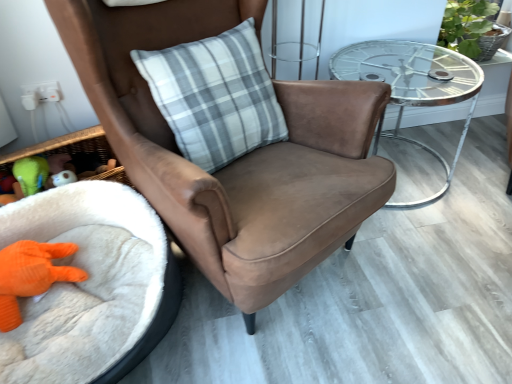
Question: Based on their sizes in the image, would you say orange knitted toy at lower left, the 2th toy positioned from the top, is bigger or smaller than gray plaid pillow at center?

Choices:
 (A) small
 (B) big

Answer: (A)

Question: Is orange knitted toy at lower left, the 2th toy positioned from the top, in front of or behind gray plaid pillow at center in the image?

Choices:
 (A) behind
 (B) front

Answer: (A)

Question: Which is farther from the suede brown armchair at center?

Choices:
 (A) white fluffy infant bed at lower left
 (B) green rubber duck at lower left, placed as the second toy when sorted from bottom to top
 (C) metallic glass table at right
 (D) orange knitted toy at lower left, the first toy in the bottom-to-top sequence
 (E) gray plaid pillow at center

Answer: (B)

Question: Estimate the real-world distances between objects in this image. Which object is closer to the metallic glass table at right?

Choices:
 (A) suede brown armchair at center
 (B) green leafy plant at upper right
 (C) orange knitted toy at lower left, the 2th toy positioned from the top
 (D) green rubber duck at lower left, the 1th toy when ordered from top to bottom
 (E) white fluffy infant bed at lower left

Answer: (B)